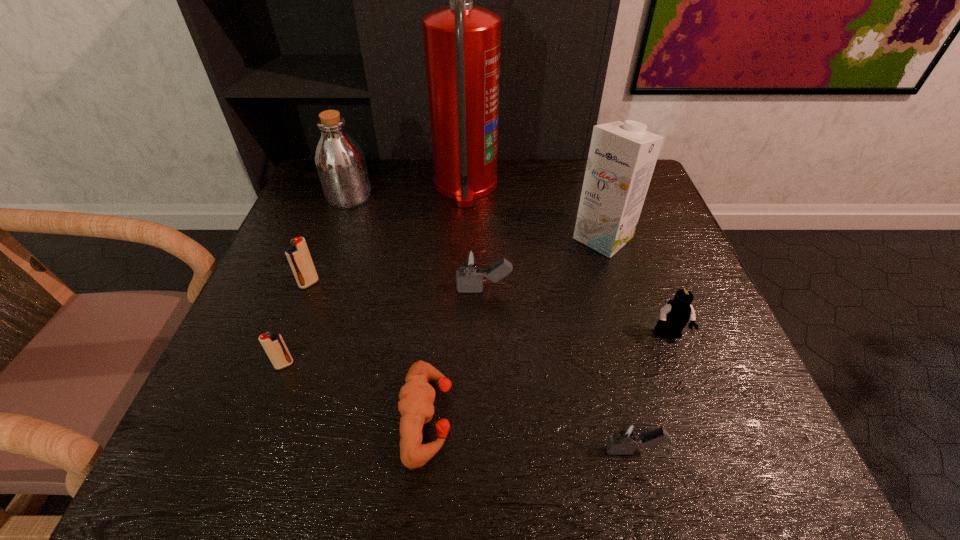
Locate an element on the screen. carton that is positioned at the right edge is located at coordinates (622, 156).

Where is `Lego that is at the right edge`? Image resolution: width=960 pixels, height=540 pixels. Lego that is at the right edge is located at coordinates (674, 316).

Identify the location of object present at the far left corner. (340, 162).

You are a GUI agent. You are given a task and a screenshot of the screen. Output one action in this format:
    pyautogui.click(x=<x>, y=<y>)
    Task: Click on the vacant space at the far edge
    
    Given the screenshot: What is the action you would take?
    pyautogui.click(x=378, y=190)

This screenshot has height=540, width=960. Find the location of `blank space at the left edge`. blank space at the left edge is located at coordinates tap(311, 212).

Identify the location of free space at the right edge of the desktop. (649, 244).

Where is `vacant space at the far left corner of the desktop`? This screenshot has height=540, width=960. vacant space at the far left corner of the desktop is located at coordinates (307, 190).

The height and width of the screenshot is (540, 960). I want to click on free spot between the bigger gray igniter and the fire extinguisher, so click(475, 238).

Where is `free spot between the red puncher and the seventh nearest object`? free spot between the red puncher and the seventh nearest object is located at coordinates (516, 328).

Where is `unoccupied area between the farther red igniter and the shortest object`? The image size is (960, 540). unoccupied area between the farther red igniter and the shortest object is located at coordinates (369, 350).